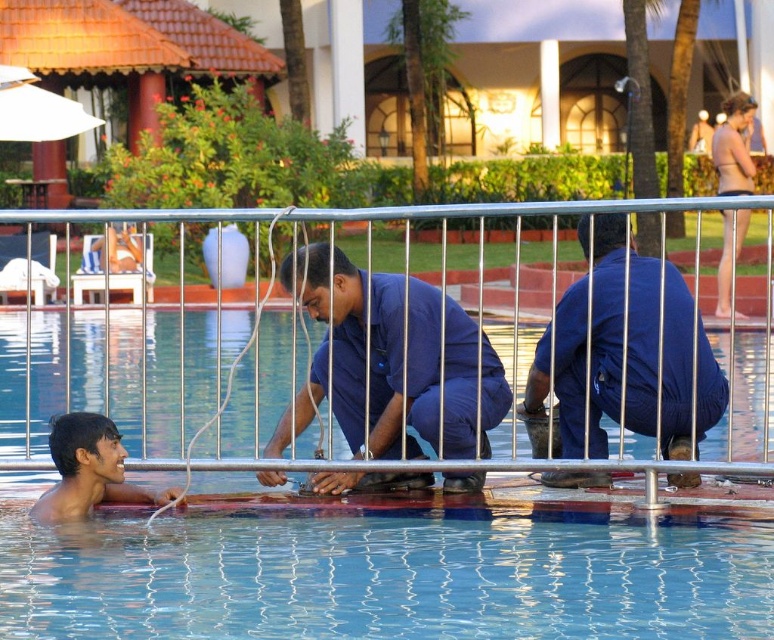
Question: Which of the following is the closest to the observer?

Choices:
 (A) (399, 595)
 (B) (324, 289)
 (C) (189, 301)
 (D) (663, 372)

Answer: (A)

Question: Which of these objects is positioned closest to the blue fabric pants at lower right?

Choices:
 (A) smooth skin face at lower left
 (B) blue uniform at center
 (C) metallic silver rail at center

Answer: (B)

Question: Is blue uniform at center further to the viewer compared to blue fabric pants at lower right?

Choices:
 (A) yes
 (B) no

Answer: (A)

Question: Is blue rubber pool at center to the left of smooth skin face at lower left from the viewer's perspective?

Choices:
 (A) no
 (B) yes

Answer: (A)

Question: Which is nearer to the smooth skin face at lower left?

Choices:
 (A) blue fabric pants at lower right
 (B) blue uniform at center
 (C) metallic silver rail at center

Answer: (B)

Question: Does blue uniform at center appear over smooth skin face at lower left?

Choices:
 (A) yes
 (B) no

Answer: (A)